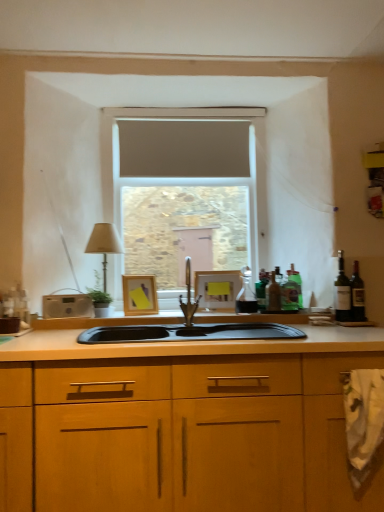
Find the location of `polished stainless steel faucet at center`. polished stainless steel faucet at center is located at coordinates (188, 297).

Measure the distance between point (194,308) and camera.

Point (194,308) is 2.38 meters from camera.

The image size is (384, 512). Describe the element at coordinates (139, 294) in the screenshot. I see `wooden picture frame at center, which ranks as the second picture frame in right-to-left order` at that location.

At what (x,y) coordinates should I click in order to perform the action: click on wooden picture frame at center, which ranks as the second picture frame in right-to-left order. Please return your answer as a coordinate pair (x, y). This screenshot has width=384, height=512. Looking at the image, I should click on (139, 294).

At what (x,y) coordinates should I click in order to perform the action: click on matte gray screen at center. Please return your answer as a coordinate pair (x, y). Image resolution: width=384 pixels, height=512 pixels. Looking at the image, I should click on (183, 148).

Where is `beige fabric lampshade at left`? The height and width of the screenshot is (512, 384). beige fabric lampshade at left is located at coordinates (104, 244).

The height and width of the screenshot is (512, 384). Describe the element at coordinates (357, 295) in the screenshot. I see `dark glass bottle at right, positioned as the first wine bottle in right-to-left order` at that location.

Identify the location of green glass bottle at right, which ranks as the fourth bottle in left-to-right order. The image size is (384, 512). (296, 283).

The image size is (384, 512). There is a polished stainless steel faucet at center. Identify the location of the 1st bottle below it (from the image's perspective). (246, 294).

From the image's perspective, is translucent glass carafe at center, which is counted as the 1th bottle, starting from the left, positioned above or below polished stainless steel faucet at center?

translucent glass carafe at center, which is counted as the 1th bottle, starting from the left, is below polished stainless steel faucet at center.

From a real-world perspective, who is located higher, translucent glass carafe at center, which is counted as the 1th bottle, starting from the left, or polished stainless steel faucet at center?

polished stainless steel faucet at center, from a real-world perspective.

Is translucent glass carafe at center, which is counted as the 1th bottle, starting from the left, taller than polished stainless steel faucet at center?

No.

Which is nearer, (184, 304) or (363, 314)?

Point (184, 304).

Considering the sizes of polished stainless steel faucet at center and dark glass bottle at right, positioned as the first wine bottle in right-to-left order, in the image, is polished stainless steel faucet at center bigger or smaller than dark glass bottle at right, positioned as the first wine bottle in right-to-left order,?

In the image, polished stainless steel faucet at center appears to be larger than dark glass bottle at right, positioned as the first wine bottle in right-to-left order.

Considering the positions of objects polished stainless steel faucet at center and dark glass bottle at right, the second wine bottle from the left, in the image provided, who is in front, polished stainless steel faucet at center or dark glass bottle at right, the second wine bottle from the left,?

polished stainless steel faucet at center is closer to the camera.

Between polished stainless steel faucet at center and dark glass bottle at right, positioned as the first wine bottle in right-to-left order, which one has more height?

polished stainless steel faucet at center.

Is green glass bottle at right, which ranks as the fourth bottle in left-to-right order, facing away from translucent glass carafe at center, which is counted as the 1th bottle, starting from the left?

No, translucent glass carafe at center, which is counted as the 1th bottle, starting from the left, is not at the back of green glass bottle at right, which ranks as the fourth bottle in left-to-right order.

Does point (295, 271) come farther from viewer compared to point (238, 312)?

Yes, point (295, 271) is behind point (238, 312).

Relative to translucent glass carafe at center, which is counted as the 1th bottle, starting from the left, is green glass bottle at right, the 1th bottle when ordered from right to left, in front or behind?

green glass bottle at right, the 1th bottle when ordered from right to left, is behind translucent glass carafe at center, which is counted as the 1th bottle, starting from the left.

Is green glass bottle at right, the 1th bottle when ordered from right to left, smaller than translucent glass carafe at center, marked as the 4th bottle in a right-to-left arrangement?

Yes.

Considering the positions of point (97, 253) and point (206, 282), is point (97, 253) closer or farther from the camera than point (206, 282)?

Point (97, 253) is positioned closer to the camera compared to point (206, 282).

From the image's perspective, which is above, beige fabric lampshade at left or matte wooden picture frame at center, the 2th picture frame positioned from the left?

beige fabric lampshade at left appears higher in the image.

Is beige fabric lampshade at left at the right side of matte wooden picture frame at center, the 2th picture frame positioned from the left?

No.

In the scene shown: Looking at the image, does wooden picture frame at center, which ranks as the second picture frame in right-to-left order, seem bigger or smaller compared to green glass bottle at right, which ranks as the fourth bottle in left-to-right order?

Considering their sizes, wooden picture frame at center, which ranks as the second picture frame in right-to-left order, takes up more space than green glass bottle at right, which ranks as the fourth bottle in left-to-right order.

From a real-world perspective, between wooden picture frame at center, arranged as the 1th picture frame when viewed from the left, and green glass bottle at right, which ranks as the fourth bottle in left-to-right order, who is vertically lower?

wooden picture frame at center, arranged as the 1th picture frame when viewed from the left, is physically lower.

Is wooden picture frame at center, arranged as the 1th picture frame when viewed from the left, shorter than green glass bottle at right, which ranks as the fourth bottle in left-to-right order?

No, wooden picture frame at center, arranged as the 1th picture frame when viewed from the left, is not shorter than green glass bottle at right, which ranks as the fourth bottle in left-to-right order.

Is wooden picture frame at center, arranged as the 1th picture frame when viewed from the left, inside or outside of green glass bottle at right, which ranks as the fourth bottle in left-to-right order?

wooden picture frame at center, arranged as the 1th picture frame when viewed from the left, lies outside green glass bottle at right, which ranks as the fourth bottle in left-to-right order.

Identify the location of tap on the left of matte wooden picture frame at center, the 2th picture frame positioned from the left. (188, 297).

Which object is wider, matte wooden picture frame at center, the 2th picture frame positioned from the left, or polished stainless steel faucet at center?

With larger width is polished stainless steel faucet at center.

Relative to polished stainless steel faucet at center, is matte wooden picture frame at center, the 2th picture frame positioned from the left, in front or behind?

matte wooden picture frame at center, the 2th picture frame positioned from the left, is behind polished stainless steel faucet at center.

Can you tell me how much matte wooden picture frame at center, arranged as the first picture frame when viewed from the right, and polished stainless steel faucet at center differ in facing direction?

11.5 degrees separate the facing orientations of matte wooden picture frame at center, arranged as the first picture frame when viewed from the right, and polished stainless steel faucet at center.

Could you tell me if matte gray screen at center is facing translucent glass bottle at right, placed as the second bottle when sorted from left to right?

No, matte gray screen at center does not turn towards translucent glass bottle at right, placed as the second bottle when sorted from left to right.

Find the location of a particular element. window screen lying on the left of translucent glass bottle at right, which is the third bottle from right to left is located at coordinates (183, 148).

Consider the image. Which is correct: matte gray screen at center is inside translucent glass bottle at right, which is the third bottle from right to left, or outside of it?

matte gray screen at center is outside translucent glass bottle at right, which is the third bottle from right to left.

Is the position of matte gray screen at center less distant than that of translucent glass bottle at right, placed as the second bottle when sorted from left to right?

No, it is behind translucent glass bottle at right, placed as the second bottle when sorted from left to right.

This screenshot has height=512, width=384. Find the location of `bottle that is the 1st one when counting rightward from the polished stainless steel faucet at center`. bottle that is the 1st one when counting rightward from the polished stainless steel faucet at center is located at coordinates (246, 294).

Where is `tap to the left of dark glass bottle at right, the second wine bottle from the left`? tap to the left of dark glass bottle at right, the second wine bottle from the left is located at coordinates (188, 297).

Based on their spatial positions, is translucent glass carafe at center, which is counted as the 1th bottle, starting from the left, or polished stainless steel faucet at center further from beige fabric lampshade at left?

translucent glass carafe at center, which is counted as the 1th bottle, starting from the left, is further to beige fabric lampshade at left.

Considering their positions, is green glass bottle at right, arranged as the 2th wine bottle when viewed from the right, positioned closer to translucent glass carafe at center, marked as the 4th bottle in a right-to-left arrangement, than green glass bottle at right, acting as the second bottle starting from the right?

Based on the image, green glass bottle at right, acting as the second bottle starting from the right, appears to be nearer to translucent glass carafe at center, marked as the 4th bottle in a right-to-left arrangement.

Which object lies further to the anchor point dark glass bottle at right, positioned as the first wine bottle in right-to-left order, green glass bottle at right, acting as the second bottle starting from the right, or matte wooden picture frame at center, arranged as the first picture frame when viewed from the right?

matte wooden picture frame at center, arranged as the first picture frame when viewed from the right, is positioned further to the anchor dark glass bottle at right, positioned as the first wine bottle in right-to-left order.

Considering their positions, is polished stainless steel faucet at center positioned closer to matte wooden picture frame at center, arranged as the first picture frame when viewed from the right, than dark glass bottle at right, positioned as the first wine bottle in right-to-left order?

Based on the image, polished stainless steel faucet at center appears to be nearer to matte wooden picture frame at center, arranged as the first picture frame when viewed from the right.

In the scene shown: Estimate the real-world distances between objects in this image. Which object is closer to wooden picture frame at center, which ranks as the second picture frame in right-to-left order, matte wooden picture frame at center, the 2th picture frame positioned from the left, or green glass bottle at right, which ranks as the fourth bottle in left-to-right order?

matte wooden picture frame at center, the 2th picture frame positioned from the left, is positioned closer to the anchor wooden picture frame at center, which ranks as the second picture frame in right-to-left order.

From the picture: Which object lies further to the anchor point matte wooden picture frame at center, arranged as the first picture frame when viewed from the right, matte gray screen at center or green glass bottle at right, the 1th bottle when ordered from right to left?

Based on the image, matte gray screen at center appears to be further to matte wooden picture frame at center, arranged as the first picture frame when viewed from the right.

Looking at the image, which one is located further to dark glass bottle at right, positioned as the first wine bottle in right-to-left order, green glass bottle at right, which ranks as the fourth bottle in left-to-right order, or translucent glass carafe at center, marked as the 4th bottle in a right-to-left arrangement?

Among the two, translucent glass carafe at center, marked as the 4th bottle in a right-to-left arrangement, is located further to dark glass bottle at right, positioned as the first wine bottle in right-to-left order.

Which object lies further to the anchor point green glass bottle at right, acting as the second bottle starting from the right, green glass bottle at right, the 1th bottle when ordered from right to left, or dark glass bottle at right, positioned as the first wine bottle in right-to-left order?

dark glass bottle at right, positioned as the first wine bottle in right-to-left order, is positioned further to the anchor green glass bottle at right, acting as the second bottle starting from the right.

Find the location of `tap between matte gray screen at center and green glass bottle at right, acting as the third bottle starting from the left, vertically`. tap between matte gray screen at center and green glass bottle at right, acting as the third bottle starting from the left, vertically is located at coordinates (188, 297).

Identify the location of bottle situated between wooden picture frame at center, which ranks as the second picture frame in right-to-left order, and translucent glass bottle at right, placed as the second bottle when sorted from left to right, from left to right. The image size is (384, 512). (246, 294).

The image size is (384, 512). I want to click on picture frame between wooden picture frame at center, arranged as the 1th picture frame when viewed from the left, and green glass bottle at right, acting as the second bottle starting from the right, in the horizontal direction, so (217, 289).

This screenshot has height=512, width=384. In order to click on bottle situated between translucent glass carafe at center, marked as the 4th bottle in a right-to-left arrangement, and green glass bottle at right, acting as the second bottle starting from the right, from left to right in this screenshot , I will do `click(273, 295)`.